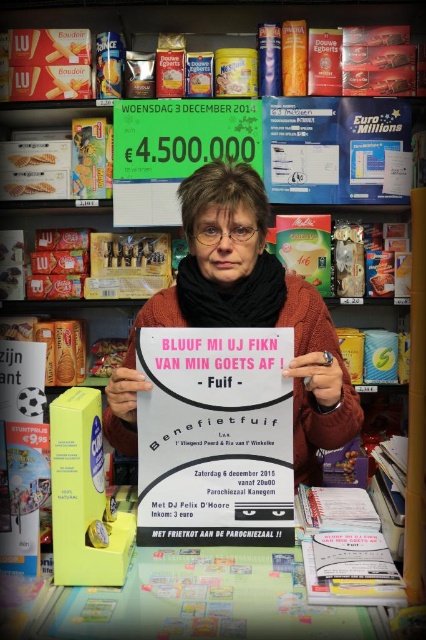
You are a delivery person who needs to place a new poster between the pink paper poster at center and the matte white poster at center. The new poster is 7 inches wide. Can you fit it between them without overlapping either poster?

The distance between the pink paper poster at center and the matte white poster at center is 6.59 inches. Since the new poster is 7 inches wide, it cannot fit between them without overlapping either poster.

You are a customer in the convenience store and you want to find the matte white poster at center to read the event details. Where should you look to find it?

The matte white poster at center is located at point (244, 314), so you should look there to find it.

You are a customer in the store and want to know which item is taller between the pink paper poster at center and the white paper book at lower center. Can you tell me?

The pink paper poster at center is taller than the white paper book at lower center.